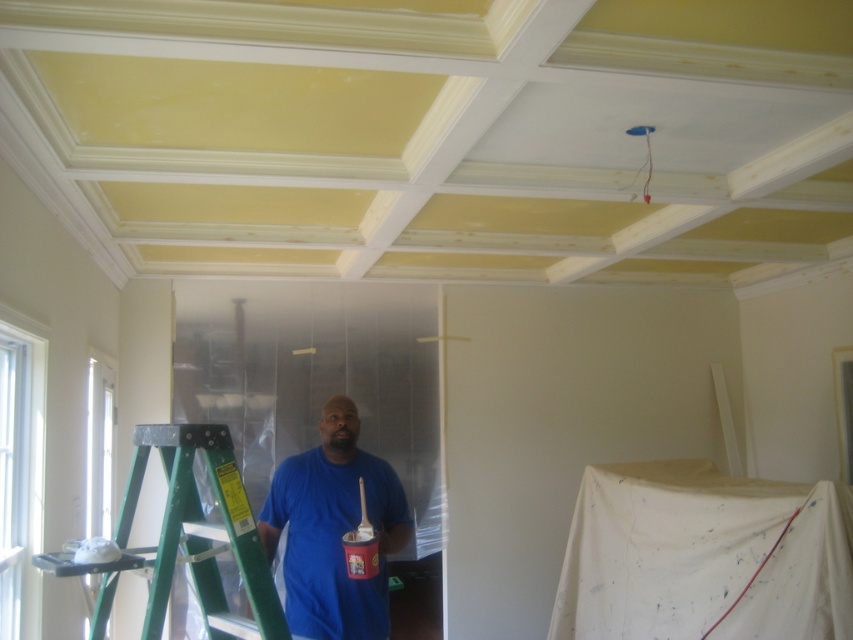
You are standing in the middle of the room and see two points marked on the wall. Which point is closer to you, point (318, 532) or point (146, 451)?

Point (318, 532) is further to the viewer than point (146, 451), so the closer point to you is point (146, 451).